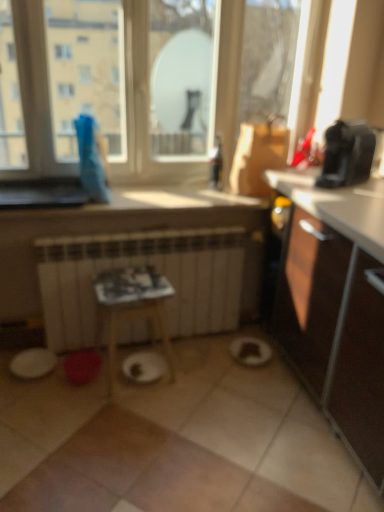
I want to click on vacant space to the right of wooden table at center, so click(198, 374).